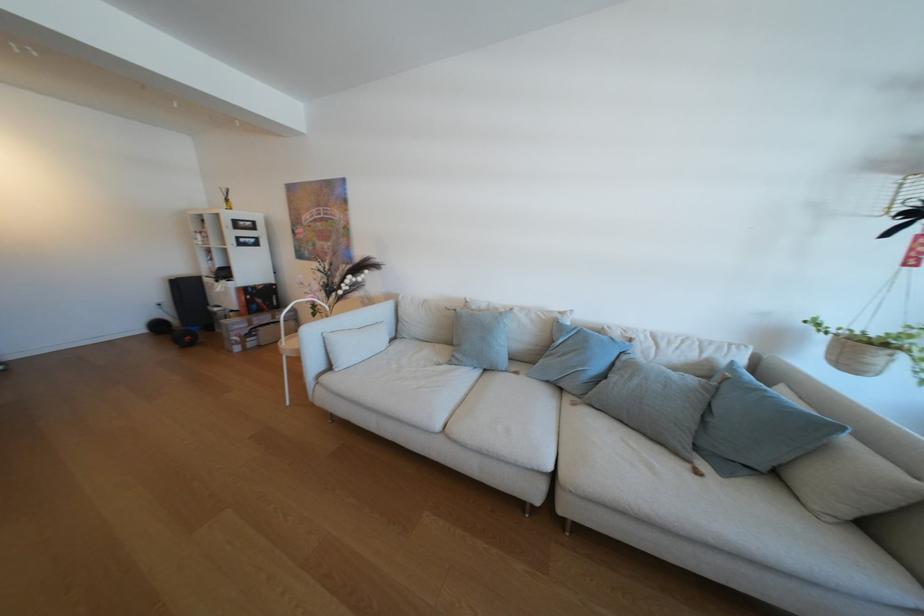
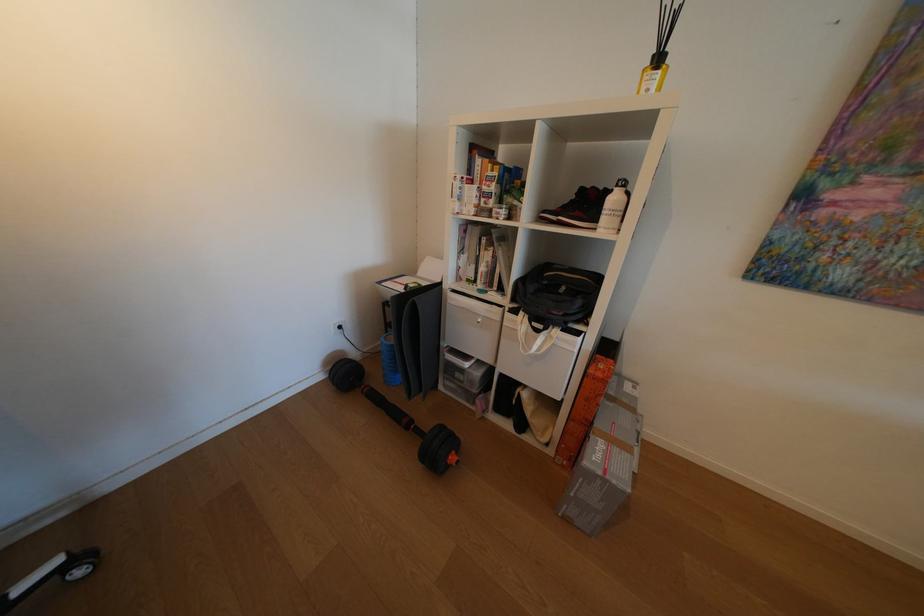
Which direction would the cameraman need to move to produce the second image?

The cameraman moved toward left, forward.